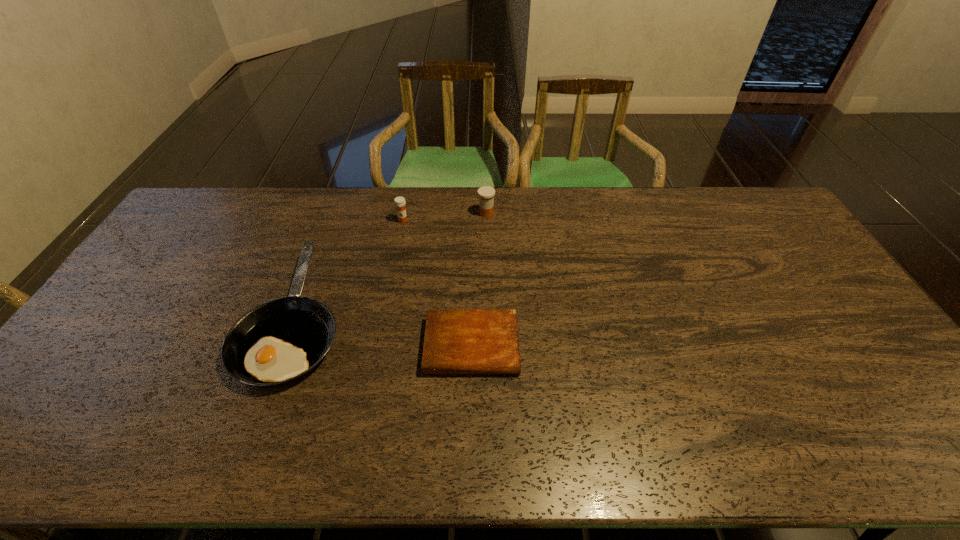
Image resolution: width=960 pixels, height=540 pixels. I want to click on vacant space located on the spine side of the shortest object, so click(x=470, y=442).

This screenshot has height=540, width=960. I want to click on blank space at the far edge of the desktop, so click(x=590, y=195).

Find the location of a particular element. vacant space at the near edge is located at coordinates (597, 441).

Identify the location of free region at the left edge of the desktop. coord(190,242).

Where is `vacant space at the right edge of the desktop`? The height and width of the screenshot is (540, 960). vacant space at the right edge of the desktop is located at coordinates (857, 389).

Image resolution: width=960 pixels, height=540 pixels. Identify the location of vacant region at the near left corner of the desktop. (55, 445).

In order to click on free spot between the shortest object and the left medicine in this screenshot , I will do `click(438, 284)`.

This screenshot has width=960, height=540. I want to click on free space between the left medicine and the frying pan, so click(x=349, y=268).

Locate an element on the screen. This screenshot has height=540, width=960. free space between the right medicine and the second shortest object is located at coordinates (392, 265).

The height and width of the screenshot is (540, 960). I want to click on free space between the left medicine and the frying pan, so click(x=349, y=268).